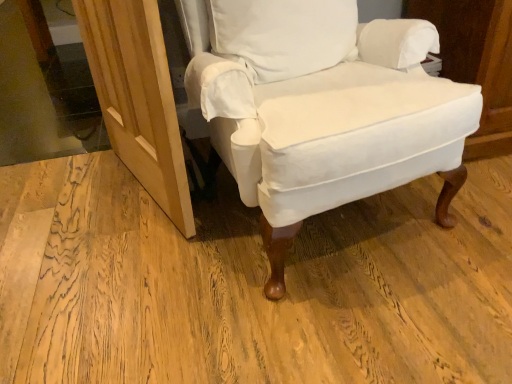
The height and width of the screenshot is (384, 512). Identify the location of free space in front of natural wood screen door at lower left. (132, 270).